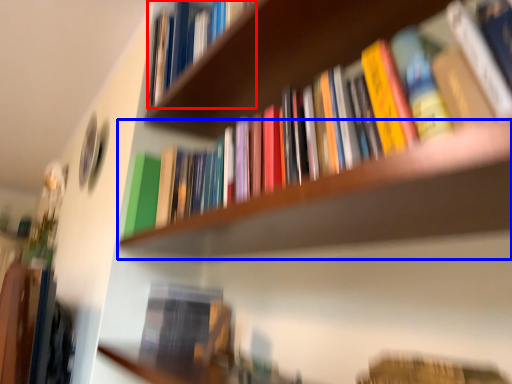
Question: Which of the following is the farthest to the observer, book (highlighted by a red box) or shelf (highlighted by a blue box)?

Choices:
 (A) book
 (B) shelf

Answer: (A)